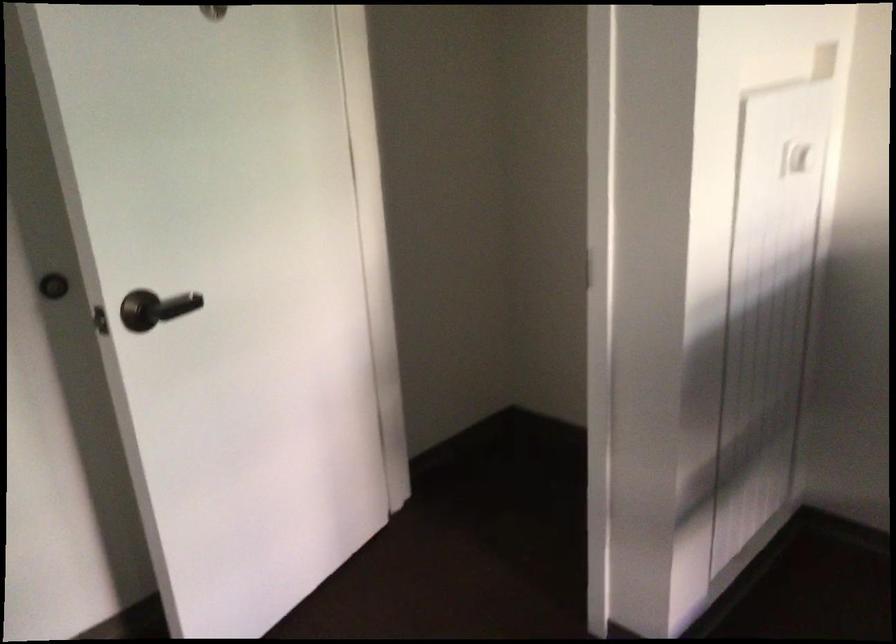
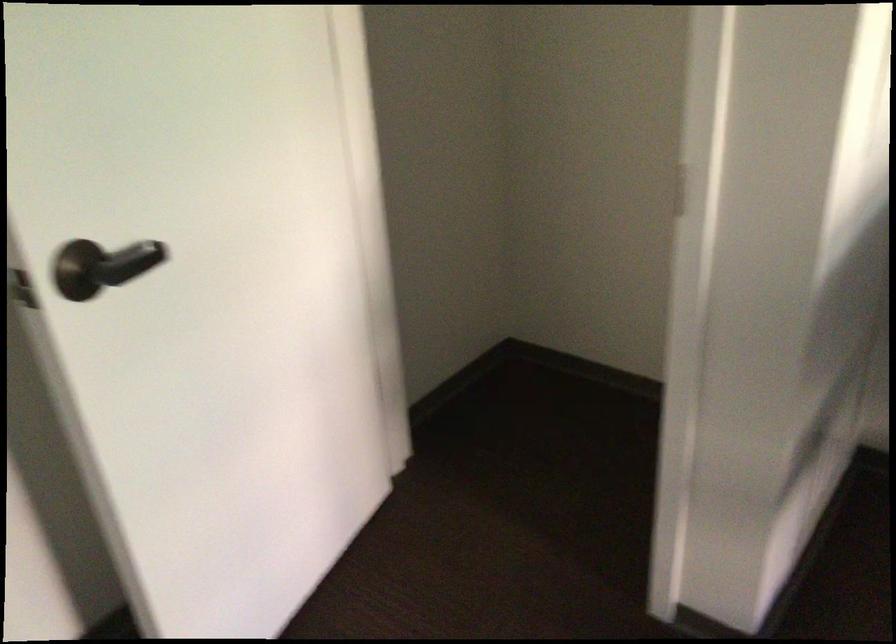
The point at (158, 305) is marked in the first image. Where is the corresponding point in the second image?

(107, 265)